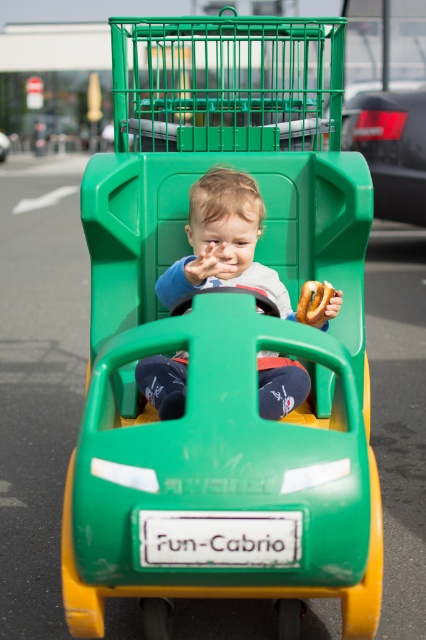
Is green matte car at center smaller than golden brown pretzel at center?

No, green matte car at center is not smaller than golden brown pretzel at center.

From the picture: Is green matte car at center to the right of golden brown pretzel at center from the viewer's perspective?

Indeed, green matte car at center is positioned on the right side of golden brown pretzel at center.

I want to click on green matte car at center, so click(391, 148).

Image resolution: width=426 pixels, height=640 pixels. In order to click on green matte car at center in this screenshot , I will do `click(391, 148)`.

Which is more to the left, matte green toddler at center or green matte car at center?

matte green toddler at center is more to the left.

Is matte green toddler at center positioned behind green matte car at center?

No, it is in front of green matte car at center.

Who is more distant from viewer, (180, 349) or (391, 176)?

Point (391, 176)

The image size is (426, 640). Find the location of `matte green toddler at center`. matte green toddler at center is located at coordinates (222, 241).

Can you confirm if matte green toddler at center is wider than golden brown pretzel at center?

Indeed, matte green toddler at center has a greater width compared to golden brown pretzel at center.

Can you confirm if matte green toddler at center is thinner than golden brown pretzel at center?

No.

Describe the element at coordinates (222, 241) in the screenshot. The image size is (426, 640). I see `matte green toddler at center` at that location.

Locate an element on the screen. The height and width of the screenshot is (640, 426). matte green toddler at center is located at coordinates (222, 241).